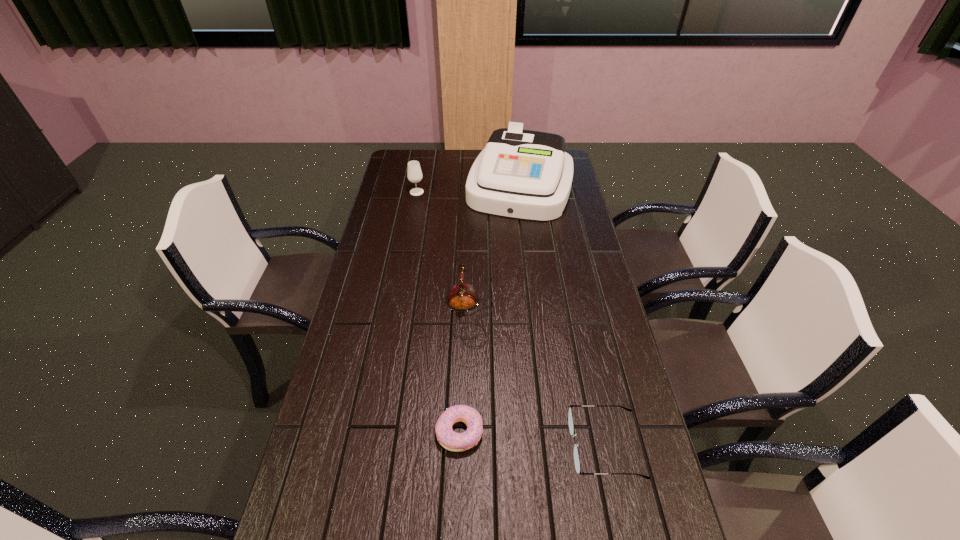
Where is `cash register`? The image size is (960, 540). cash register is located at coordinates (522, 174).

The height and width of the screenshot is (540, 960). I want to click on the fourth shortest object, so click(414, 173).

Locate an element on the screen. The height and width of the screenshot is (540, 960). the leftmost object is located at coordinates (414, 173).

Identify the location of the third farthest object. (462, 297).

Locate an element on the screen. The height and width of the screenshot is (540, 960). telephone is located at coordinates (462, 297).

Where is `the fourth tallest object`? The width and height of the screenshot is (960, 540). the fourth tallest object is located at coordinates (570, 417).

You are a GUI agent. You are given a task and a screenshot of the screen. Output one action in this format:
    pyautogui.click(x=<x>, y=<y>)
    Task: Click on the shortest object
    This screenshot has width=960, height=540.
    Given the screenshot: What is the action you would take?
    pyautogui.click(x=456, y=442)

Image resolution: width=960 pixels, height=540 pixels. In order to click on free location located on the left of the tallest object in this screenshot , I will do `click(393, 187)`.

Where is `free point located on the right of the leftmost object`? This screenshot has height=540, width=960. free point located on the right of the leftmost object is located at coordinates (508, 192).

Where is `free space located 0.290m on the rotary dial of the third tallest object`? This screenshot has height=540, width=960. free space located 0.290m on the rotary dial of the third tallest object is located at coordinates (585, 314).